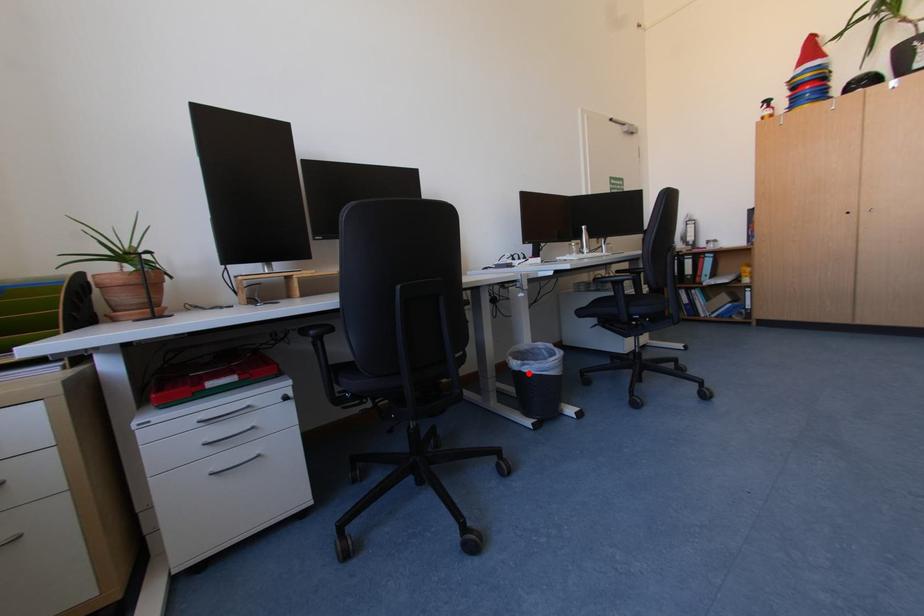
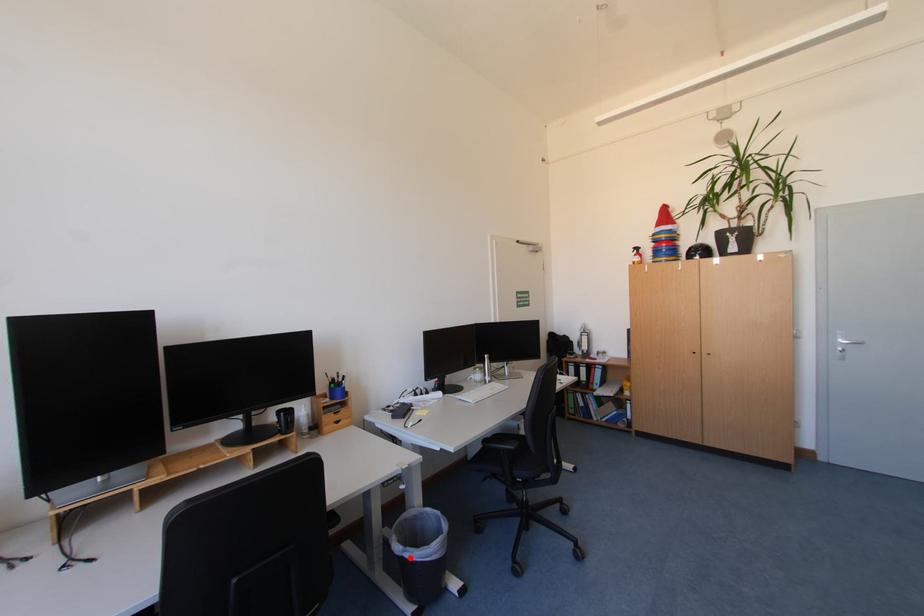
I am providing you with two images of the same scene from different viewpoints. A red point is marked on the first image and another point is marked on the second image. Is the marked point in image1 the same physical position as the marked point in image2?

Yes